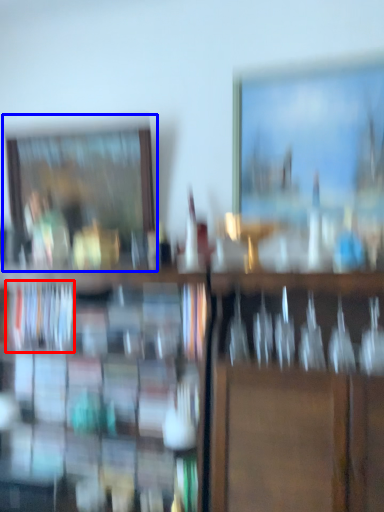
Question: Which point is closer to the camera, book (highlighted by a red box) or picture frame (highlighted by a blue box)?

Choices:
 (A) book
 (B) picture frame

Answer: (A)